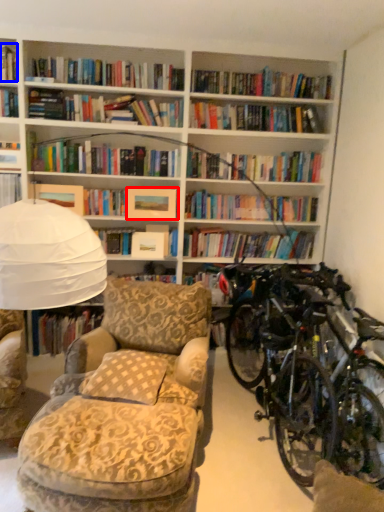
Question: Which object appears farthest to the camera in this image, paperback book (highlighted by a red box) or book (highlighted by a blue box)?

Choices:
 (A) paperback book
 (B) book

Answer: (A)